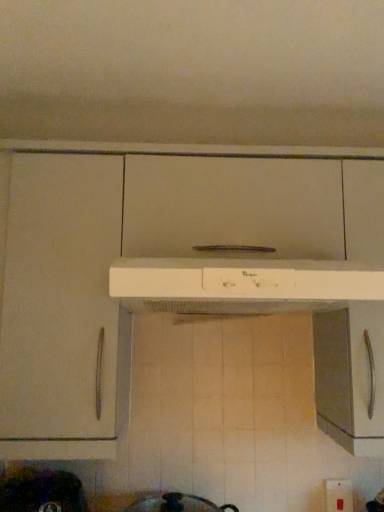
Describe the element at coordinates (40, 490) in the screenshot. The width and height of the screenshot is (384, 512). I see `metallic dark gray pot at lower left` at that location.

Where is `white plastic range hood at center`? white plastic range hood at center is located at coordinates (241, 285).

Image resolution: width=384 pixels, height=512 pixels. What do you see at coordinates (338, 495) in the screenshot? I see `white plastic electric outlet at lower right` at bounding box center [338, 495].

You are a GUI agent. You are given a task and a screenshot of the screen. Output one action in this format:
    pyautogui.click(x=<x>, y=<y>)
    Task: Click on the metallic dark gray pot at lower left
    
    Given the screenshot: What is the action you would take?
    pyautogui.click(x=40, y=490)

Could you tell me if metallic dark gray pot at lower left is turned towards white plastic electric outlet at lower right?

No, metallic dark gray pot at lower left is not oriented towards white plastic electric outlet at lower right.

Is metallic dark gray pot at lower left not close to white plastic electric outlet at lower right?

That's not correct — metallic dark gray pot at lower left is a little close to white plastic electric outlet at lower right.

Which of these two, metallic dark gray pot at lower left or white plastic electric outlet at lower right, is thinner?

With smaller width is white plastic electric outlet at lower right.

Is metallic dark gray pot at lower left inside the boundaries of white plastic electric outlet at lower right, or outside?

metallic dark gray pot at lower left is spatially situated outside white plastic electric outlet at lower right.

From their relative heights in the image, would you say white plastic electric outlet at lower right is taller or shorter than metallic dark gray pot at lower left?

In the image, white plastic electric outlet at lower right appears to be taller than metallic dark gray pot at lower left.

Is point (330, 499) positioned after point (56, 498)?

Yes, point (330, 499) is behind point (56, 498).

Measure the distance between white plastic electric outlet at lower right and metallic dark gray pot at lower left.

The distance of white plastic electric outlet at lower right from metallic dark gray pot at lower left is 33.80 inches.

Is white plastic electric outlet at lower right smaller than metallic dark gray pot at lower left?

Yes.

From a real-world perspective, is white plastic range hood at center located higher than white plastic electric outlet at lower right?

Yes, from a real-world perspective, white plastic range hood at center is on top of white plastic electric outlet at lower right.

How different are the orientations of white plastic range hood at center and white plastic electric outlet at lower right in degrees?

The angular difference between white plastic range hood at center and white plastic electric outlet at lower right is 2.03 degrees.

How much distance is there between white plastic range hood at center and white plastic electric outlet at lower right?

white plastic range hood at center is 30.79 inches from white plastic electric outlet at lower right.

Is point (333, 262) less distant than point (332, 501)?

Yes, point (333, 262) is in front of point (332, 501).

Based on the photo, is white plastic range hood at center inside or outside of metallic dark gray pot at lower left?

white plastic range hood at center is spatially situated outside metallic dark gray pot at lower left.

Does white plastic range hood at center have a lesser width compared to metallic dark gray pot at lower left?

Incorrect, the width of white plastic range hood at center is not less than that of metallic dark gray pot at lower left.

From the image's perspective, is white plastic range hood at center on top of metallic dark gray pot at lower left?

Yes, from the image's perspective, white plastic range hood at center is on top of metallic dark gray pot at lower left.

Is white plastic range hood at center looking in the opposite direction of metallic dark gray pot at lower left?

No, metallic dark gray pot at lower left is not at the back of white plastic range hood at center.

Looking at their sizes, would you say white plastic electric outlet at lower right is wider or thinner than white plastic range hood at center?

Clearly, white plastic electric outlet at lower right has less width compared to white plastic range hood at center.

Is white plastic electric outlet at lower right located outside white plastic range hood at center?

Absolutely, white plastic electric outlet at lower right is external to white plastic range hood at center.

Does white plastic electric outlet at lower right have a greater height compared to white plastic range hood at center?

Yes.

How distant is white plastic electric outlet at lower right from white plastic range hood at center?

30.79 inches.

How different are the orientations of metallic dark gray pot at lower left and white plastic range hood at center in degrees?

metallic dark gray pot at lower left and white plastic range hood at center are facing 0.577 degrees away from each other.

Is metallic dark gray pot at lower left placed right next to white plastic range hood at center?

No, metallic dark gray pot at lower left is not with white plastic range hood at center.

Which of these two, metallic dark gray pot at lower left or white plastic range hood at center, is thinner?

metallic dark gray pot at lower left.

Does metallic dark gray pot at lower left have a smaller size compared to white plastic range hood at center?

Correct, metallic dark gray pot at lower left occupies less space than white plastic range hood at center.

This screenshot has width=384, height=512. Find the location of `electric outlet on the right of metallic dark gray pot at lower left`. electric outlet on the right of metallic dark gray pot at lower left is located at coordinates (338, 495).

The width and height of the screenshot is (384, 512). In the image, there is a metallic dark gray pot at lower left. What are the coordinates of `electric outlet below it (from a real-world perspective)` in the screenshot? It's located at (338, 495).

Looking at the image, which one is located further to white plastic range hood at center, white plastic electric outlet at lower right or metallic dark gray pot at lower left?

white plastic electric outlet at lower right is positioned further to the anchor white plastic range hood at center.

When comparing their distances from metallic dark gray pot at lower left, does white plastic range hood at center or white plastic electric outlet at lower right seem further?

white plastic electric outlet at lower right.

When comparing their distances from white plastic electric outlet at lower right, does white plastic range hood at center or metallic dark gray pot at lower left seem further?

metallic dark gray pot at lower left is further to white plastic electric outlet at lower right.

Estimate the real-world distances between objects in this image. Which object is further from metallic dark gray pot at lower left, white plastic electric outlet at lower right or white plastic range hood at center?

white plastic electric outlet at lower right is positioned further to the anchor metallic dark gray pot at lower left.

Estimate the real-world distances between objects in this image. Which object is closer to white plastic electric outlet at lower right, metallic dark gray pot at lower left or white plastic range hood at center?

white plastic range hood at center is closer to white plastic electric outlet at lower right.

From the image, which object appears to be farther from white plastic range hood at center, metallic dark gray pot at lower left or white plastic electric outlet at lower right?

white plastic electric outlet at lower right is further to white plastic range hood at center.

Find the location of a particular element. The height and width of the screenshot is (512, 384). home appliance situated between metallic dark gray pot at lower left and white plastic electric outlet at lower right from left to right is located at coordinates (241, 285).